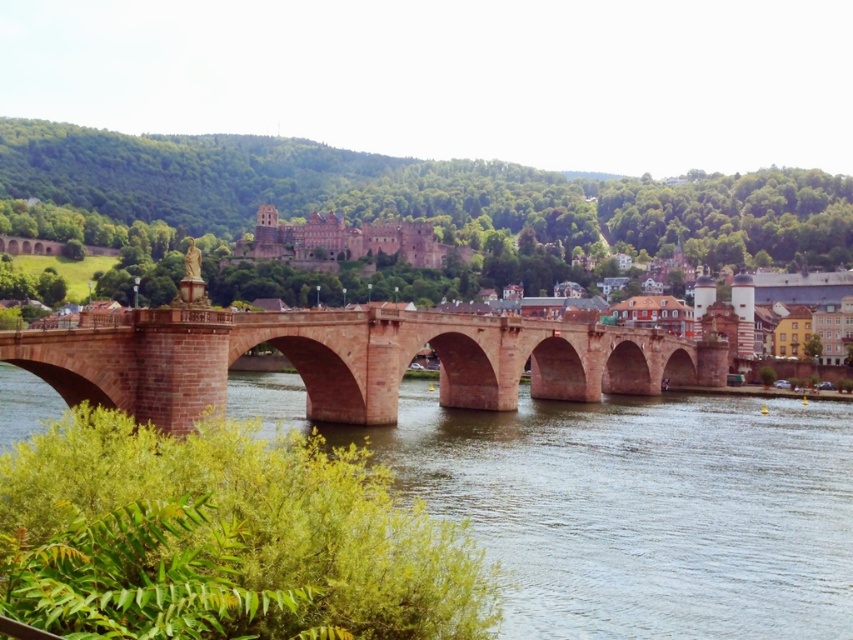
You are standing on the historic stone bridge and want to take a photo of both the point at coordinates (490, 433) and the point at coordinates (363, 244). Which point will appear larger in your camera view?

The point at coordinates (490, 433) will appear larger in your camera view because it is closer to the camera than the point at coordinates (363, 244).